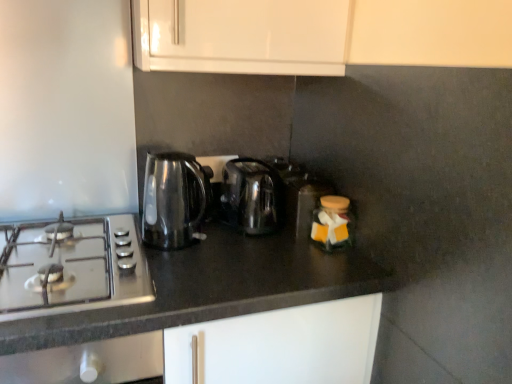
Question: From a real-world perspective, does matte glass jar at center right, which is counted as the 2th appliance, starting from the back, stand above transparent glass kettle at left, acting as the 1th kitchen appliance starting from the left?

Choices:
 (A) no
 (B) yes

Answer: (A)

Question: Is matte glass jar at center right, which is counted as the 2th appliance, starting from the back, next to transparent glass kettle at left, acting as the 1th kitchen appliance starting from the left?

Choices:
 (A) yes
 (B) no

Answer: (B)

Question: Is matte glass jar at center right, which is counted as the 2th appliance, starting from the back, oriented away from transparent glass kettle at left, acting as the 1th kitchen appliance starting from the left?

Choices:
 (A) no
 (B) yes

Answer: (A)

Question: Does matte glass jar at center right, which is counted as the 2th appliance, starting from the back, turn towards transparent glass kettle at left, acting as the 1th kitchen appliance starting from the left?

Choices:
 (A) yes
 (B) no

Answer: (B)

Question: Can you confirm if matte glass jar at center right, marked as the 1th appliance in a front-to-back arrangement, is shorter than transparent glass kettle at left, which ranks as the 2th kitchen appliance in right-to-left order?

Choices:
 (A) yes
 (B) no

Answer: (A)

Question: Is matte glass jar at center right, marked as the 1th appliance in a front-to-back arrangement, in front of transparent glass kettle at left, acting as the 1th kitchen appliance starting from the left?

Choices:
 (A) no
 (B) yes

Answer: (A)

Question: From the image's perspective, is translucent plastic container at center, arranged as the second appliance when viewed from the front, on top of matte glass jar at center right, which is counted as the 2th appliance, starting from the back?

Choices:
 (A) yes
 (B) no

Answer: (A)

Question: Is translucent plastic container at center, positioned as the first appliance in back-to-front order, aimed at matte glass jar at center right, marked as the 1th appliance in a front-to-back arrangement?

Choices:
 (A) yes
 (B) no

Answer: (A)

Question: Would you say matte glass jar at center right, marked as the 1th appliance in a front-to-back arrangement, is part of translucent plastic container at center, positioned as the first appliance in back-to-front order,'s contents?

Choices:
 (A) yes
 (B) no

Answer: (B)

Question: Is the surface of translucent plastic container at center, positioned as the first appliance in back-to-front order, in direct contact with matte glass jar at center right, marked as the 1th appliance in a front-to-back arrangement?

Choices:
 (A) no
 (B) yes

Answer: (B)

Question: Can you confirm if translucent plastic container at center, arranged as the second appliance when viewed from the front, is positioned to the right of matte glass jar at center right, which is counted as the 2th appliance, starting from the back?

Choices:
 (A) no
 (B) yes

Answer: (A)

Question: From a real-world perspective, is translucent plastic container at center, positioned as the first appliance in back-to-front order, under matte glass jar at center right, which is counted as the 2th appliance, starting from the back?

Choices:
 (A) no
 (B) yes

Answer: (A)

Question: Can you confirm if black granite countertop at center is bigger than satin silver gas stove at left?

Choices:
 (A) yes
 (B) no

Answer: (A)